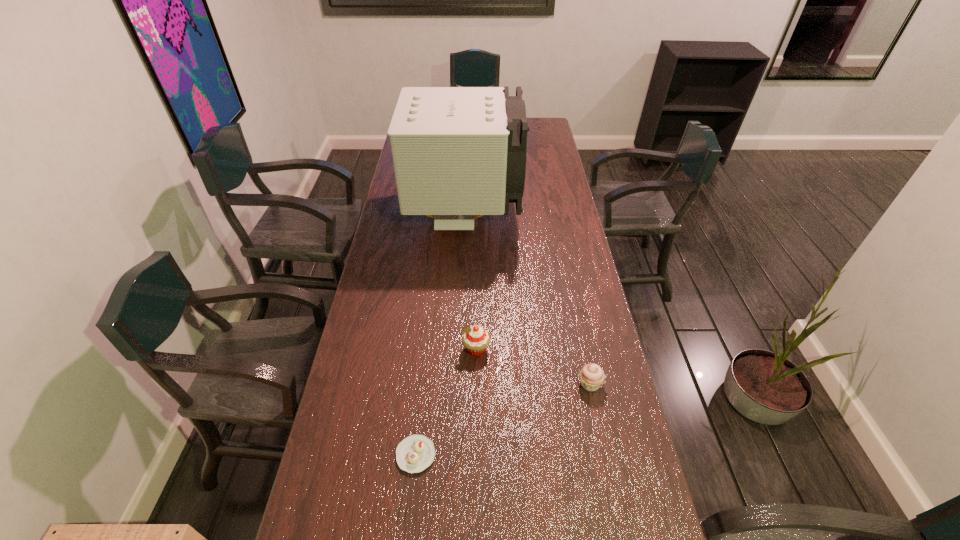
Where is `blank space located on the front of the rightmost cupcake`? The image size is (960, 540). blank space located on the front of the rightmost cupcake is located at coordinates (605, 457).

This screenshot has width=960, height=540. Find the location of `vacant region located 0.330m on the back of the shortest object`. vacant region located 0.330m on the back of the shortest object is located at coordinates (428, 335).

Where is `object at the left edge`? Image resolution: width=960 pixels, height=540 pixels. object at the left edge is located at coordinates (457, 152).

Where is `object that is at the right edge`? object that is at the right edge is located at coordinates (591, 376).

In the image, there is a desktop. At what (x,y) coordinates should I click in order to perform the action: click on blank space at the left edge. Please return your answer as a coordinate pair (x, y). This screenshot has height=540, width=960. Looking at the image, I should click on (379, 387).

Where is `vacant space at the right edge of the desktop`? vacant space at the right edge of the desktop is located at coordinates (532, 177).

I want to click on free spot between the shortest cupcake and the tallest object, so click(441, 335).

Locate an element on the screen. free spot between the second nearest cupcake and the shortest cupcake is located at coordinates pos(503,420).

The image size is (960, 540). I want to click on blank region between the nearest cupcake and the tallest cupcake, so click(446, 402).

Identify the location of free space between the fan and the nearest object. Image resolution: width=960 pixels, height=540 pixels. (441, 335).